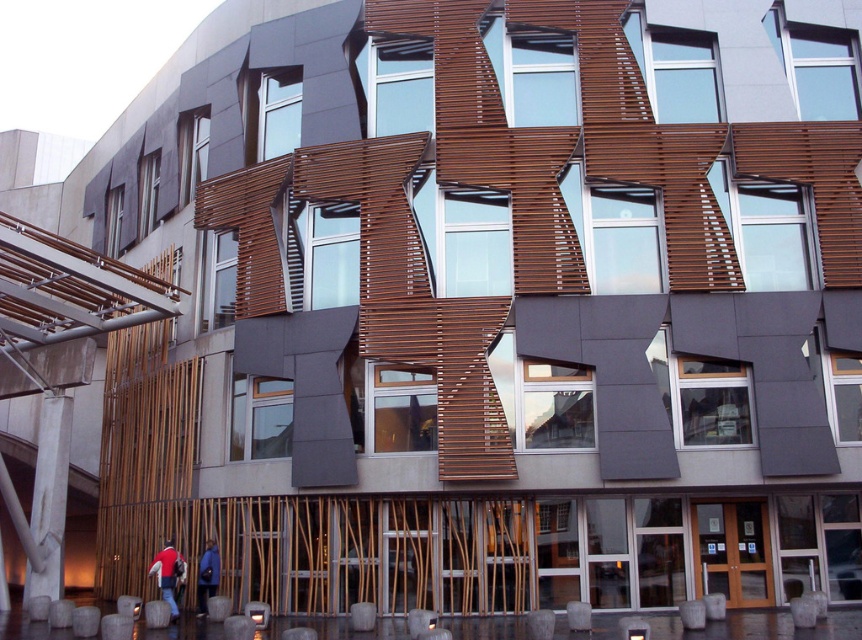
You are a visitor entering the building and notice two jackets hanging on a rack near the entrance. The red fabric jacket at lower left and the blue fabric jacket at lower center. Which jacket is shorter in height?

The red fabric jacket at lower left is shorter than the blue fabric jacket at lower center according to the description.